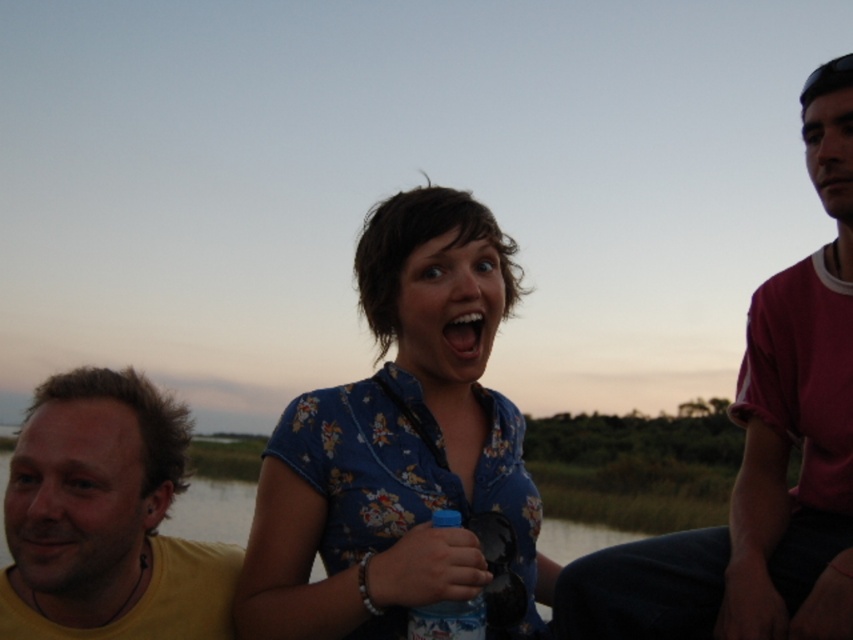
You are a photographer setting up a tripod to take a group photo of the floral cotton shirt at center and the yellow matte shirt at left. Which person should you position closer to the front to ensure both are in focus?

Since the floral cotton shirt at center is much taller than the yellow matte shirt at left, you should position the yellow matte shirt at left closer to the front to ensure both are in focus.

You are a photographer setting up a backdrop for a group photo. The backdrop is 1.8 meters wide. You need to position the matte pink shirt at right and yellow matte shirt at left so that they are side by side without overlapping. Based on their widths, will they fit within the backdrop?

The matte pink shirt at right might be wider than yellow matte shirt at left. If the combined width of both shirts exceeds 1.8 meters, they might not fit. However, since the exact widths aren